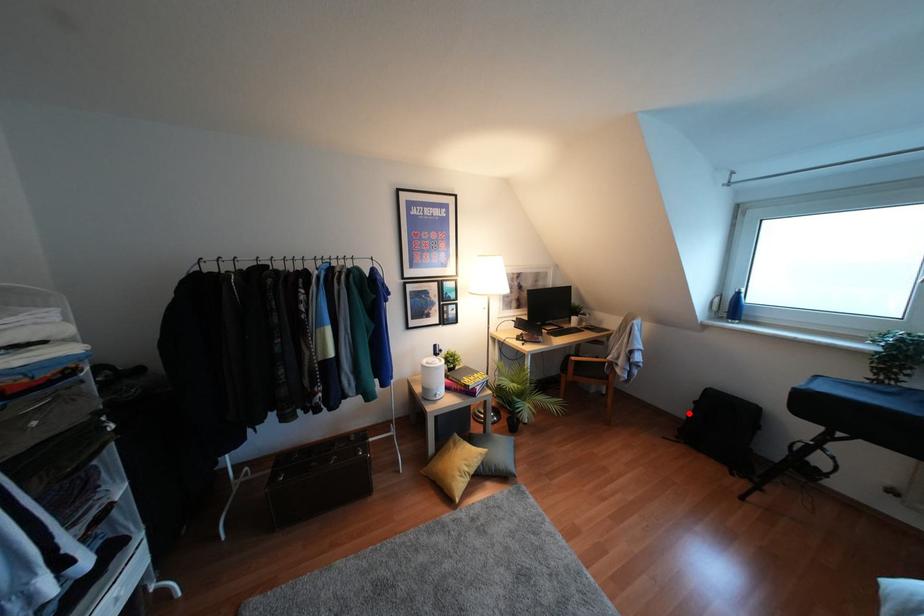
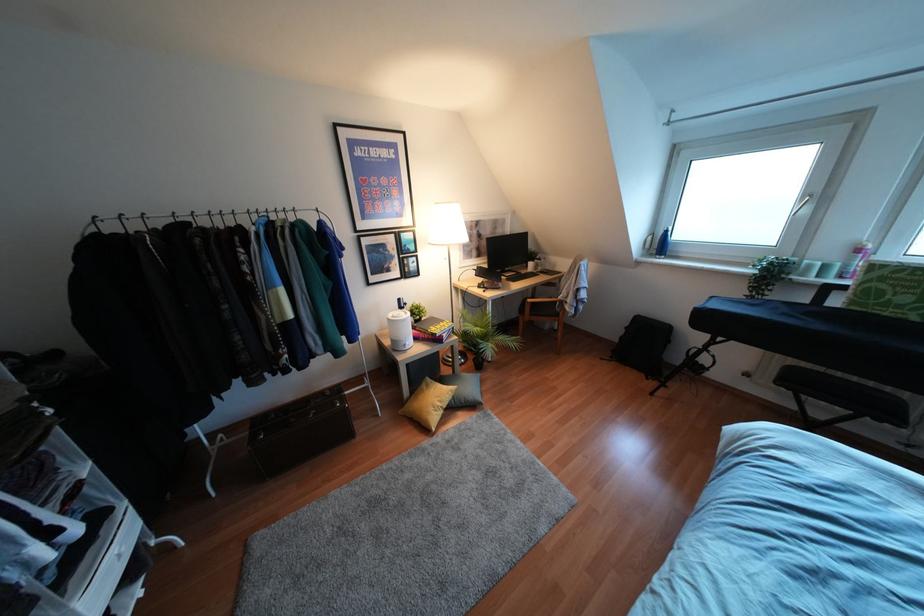
Question: A red point is marked in image1. In image2, is the corresponding 3D point closer to the camera or farther? Reply with the corresponding letter.

Choices:
 (A) The corresponding 3D point is closer.
 (B) The corresponding 3D point is farther.

Answer: (A)